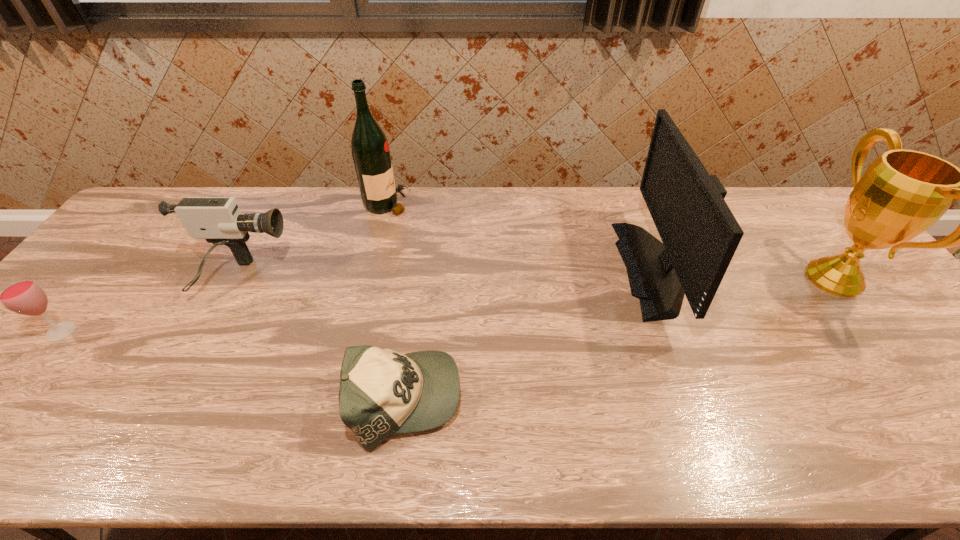
Image resolution: width=960 pixels, height=540 pixels. Find the location of `monitor at the far edge`. monitor at the far edge is located at coordinates (700, 235).

This screenshot has height=540, width=960. I want to click on object located in the near edge section of the desktop, so click(x=382, y=392).

At what (x,y) coordinates should I click in order to perform the action: click on object that is at the left edge. Please return your answer as a coordinate pair (x, y). This screenshot has height=540, width=960. Looking at the image, I should click on (23, 295).

Identify the location of object located in the right edge section of the desktop. (903, 193).

In the image, there is a desktop. Identify the location of vacant space at the far edge. The height and width of the screenshot is (540, 960). (516, 197).

Locate an element on the screen. The image size is (960, 540). blank space at the near edge is located at coordinates (468, 433).

Where is `free region at the left edge of the desktop`? free region at the left edge of the desktop is located at coordinates [145, 238].

Where is `blank area at the right edge`? blank area at the right edge is located at coordinates (938, 351).

The width and height of the screenshot is (960, 540). What are the coordinates of `free region at the far left corner of the desktop` in the screenshot? It's located at (186, 197).

Locate an element on the screen. vacant space at the far right corner is located at coordinates (755, 190).